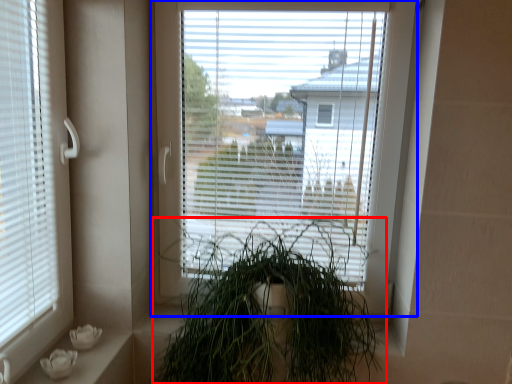
Question: Which point is further to the camera, houseplant (highlighted by a red box) or window (highlighted by a blue box)?

Choices:
 (A) houseplant
 (B) window

Answer: (B)